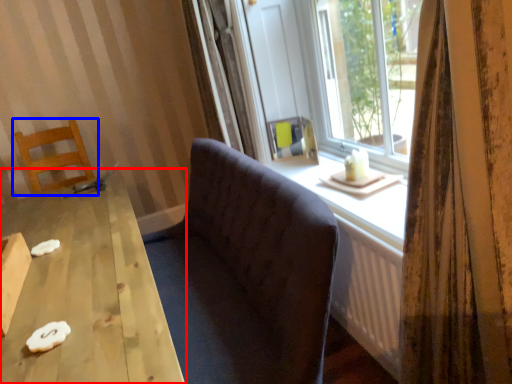
Question: Which object appears closest to the camera in this image, table (highlighted by a red box) or chair (highlighted by a blue box)?

Choices:
 (A) table
 (B) chair

Answer: (A)